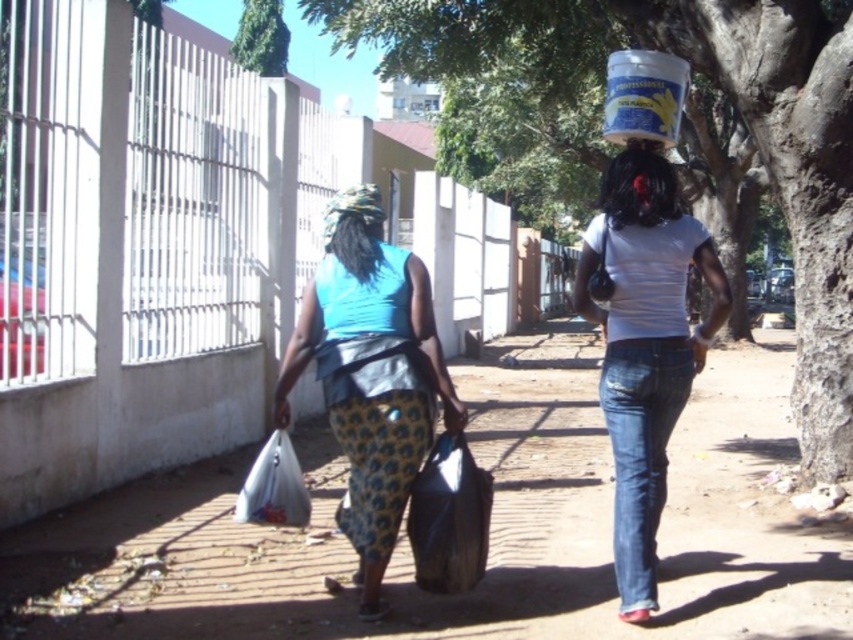
Question: Which object is positioned closest to the smooth bark tree at center right?

Choices:
 (A) white plastic bag at lower left
 (B) black plastic bag at center
 (C) dirt at center
 (D) patterned fabric headscarf at center

Answer: (C)

Question: Does blue fabric dress at center appear on the left side of black plastic bag at center?

Choices:
 (A) yes
 (B) no

Answer: (A)

Question: Which object is the closest to the blue fabric dress at center?

Choices:
 (A) dirt at center
 (B) matte white bucket at upper center
 (C) black plastic bag at center

Answer: (C)

Question: Which of these objects is positioned farthest from the white matte shirt at center?

Choices:
 (A) white plastic bag at lower left
 (B) dirt at center
 (C) black plastic bag at center

Answer: (B)

Question: Can you confirm if dirt at center is wider than smooth bark tree at center right?

Choices:
 (A) yes
 (B) no

Answer: (B)

Question: Is dirt at center to the left of patterned fabric headscarf at center from the viewer's perspective?

Choices:
 (A) no
 (B) yes

Answer: (A)